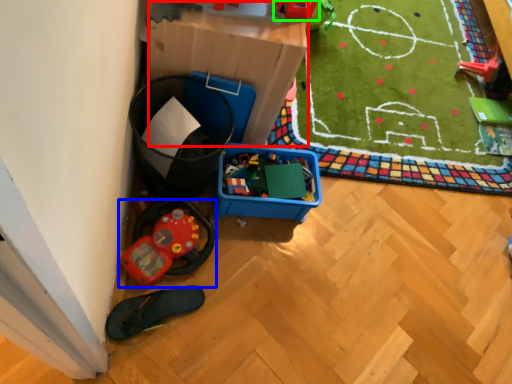
Question: Estimate the real-world distances between objects in this image. Which object is farther from storage box (highlighted by a red box), toy (highlighted by a blue box) or toy (highlighted by a green box)?

Choices:
 (A) toy
 (B) toy

Answer: (A)